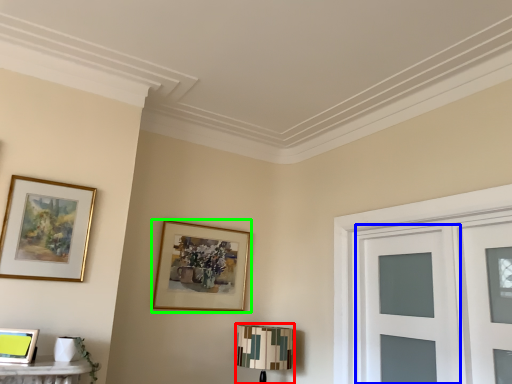
Question: Which object is the closest to the table lamp (highlighted by a red box)? Choose among these: glass door (highlighted by a blue box) or picture frame (highlighted by a green box).

Choices:
 (A) glass door
 (B) picture frame

Answer: (B)